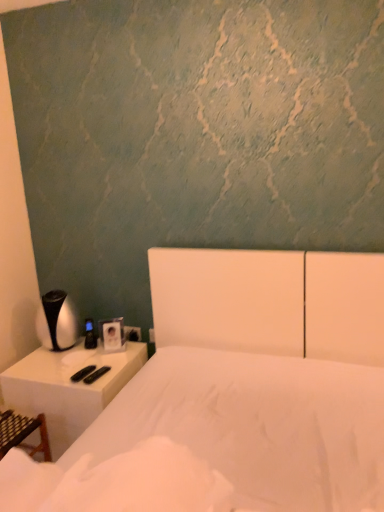
The height and width of the screenshot is (512, 384). Describe the element at coordinates (132, 333) in the screenshot. I see `white plastic electric outlet at lower center` at that location.

You are a GUI agent. You are given a task and a screenshot of the screen. Output one action in this format:
    pyautogui.click(x=<x>, y=<y>)
    Task: Click on the white matte bed at center
    
    Given the screenshot: What is the action you would take?
    [x=235, y=395]

This screenshot has width=384, height=512. Find the location of `white plastic nightstand at left`. white plastic nightstand at left is located at coordinates (68, 387).

Is white matte bed at center positioned with its back to white plastic electric outlet at lower center?

white matte bed at center is not turned away from white plastic electric outlet at lower center.

Is white matte bed at center not close to white plastic electric outlet at lower center?

No, white matte bed at center is in close proximity to white plastic electric outlet at lower center.

Who is bigger, white matte bed at center or white plastic electric outlet at lower center?

Bigger between the two is white matte bed at center.

From a real-world perspective, is white matte bed at center located beneath white plastic nightstand at left?

No, from a real-world perspective, white matte bed at center is not under white plastic nightstand at left.

Consider the image. From the image's perspective, which is below, white matte bed at center or white plastic nightstand at left?

white plastic nightstand at left is shown below in the image.

Is white matte bed at center in contact with white plastic nightstand at left?

No, white matte bed at center is not making contact with white plastic nightstand at left.

Does white matte bed at center have a lesser width compared to white plastic nightstand at left?

Incorrect, the width of white matte bed at center is not less than that of white plastic nightstand at left.

Does white plastic nightstand at left lie behind white matte bed at center?

A: Yes, white plastic nightstand at left is further from the viewer.

Considering the sizes of objects white plastic nightstand at left and white matte bed at center in the image provided, who is smaller, white plastic nightstand at left or white matte bed at center?

Smaller between the two is white plastic nightstand at left.

Can you tell me how much white plastic nightstand at left and white matte bed at center differ in facing direction?

The facing directions of white plastic nightstand at left and white matte bed at center are 0.59 degrees apart.

From the image's perspective, is white plastic nightstand at left above or below white plastic electric outlet at lower center?

Clearly, from the image's perspective, white plastic nightstand at left is below white plastic electric outlet at lower center.

What's the angular difference between white plastic nightstand at left and white plastic electric outlet at lower center's facing directions?

They differ by 0.99 degrees in their facing directions.

Does white plastic nightstand at left have a greater height compared to white plastic electric outlet at lower center?

Indeed, white plastic nightstand at left has a greater height compared to white plastic electric outlet at lower center.

Is white plastic nightstand at left wider or thinner than white plastic electric outlet at lower center?

Clearly, white plastic nightstand at left has more width compared to white plastic electric outlet at lower center.

Which is in front, white plastic electric outlet at lower center or white plastic nightstand at left?

white plastic nightstand at left.

Is white plastic electric outlet at lower center oriented away from white plastic nightstand at left?

No, white plastic electric outlet at lower center's orientation is not away from white plastic nightstand at left.

Could you measure the distance between white plastic electric outlet at lower center and white plastic nightstand at left?

white plastic electric outlet at lower center is 41.82 centimeters from white plastic nightstand at left.

Which is behind, point (135, 330) or point (64, 447)?

The point (135, 330) is farther.

Is white plastic electric outlet at lower center situated inside white matte bed at center or outside?

white plastic electric outlet at lower center lies outside white matte bed at center.

Can you tell me how much white plastic electric outlet at lower center and white matte bed at center differ in facing direction?

0.4 degrees.

From a real-world perspective, does white plastic electric outlet at lower center sit lower than white matte bed at center?

Indeed, from a real-world perspective, white plastic electric outlet at lower center is positioned beneath white matte bed at center.

Is white plastic electric outlet at lower center bigger or smaller than white matte bed at center?

Clearly, white plastic electric outlet at lower center is smaller in size than white matte bed at center.

Find the location of a particular element. electric outlet behind the white matte bed at center is located at coordinates (132, 333).

In order to click on nightstand below the white matte bed at center (from a real-world perspective) in this screenshot , I will do `click(68, 387)`.

From the picture: Based on their spatial positions, is white plastic nightstand at left or white plastic electric outlet at lower center closer to white matte bed at center?

Among the two, white plastic nightstand at left is located nearer to white matte bed at center.

Estimate the real-world distances between objects in this image. Which object is further from white plastic nightstand at left, white matte bed at center or white plastic electric outlet at lower center?

white matte bed at center.

Considering their positions, is white matte bed at center positioned further to white plastic electric outlet at lower center than white plastic nightstand at left?

white matte bed at center lies further to white plastic electric outlet at lower center than the other object.

Looking at the image, which one is located closer to white plastic electric outlet at lower center, white plastic nightstand at left or white matte bed at center?

white plastic nightstand at left is positioned closer to the anchor white plastic electric outlet at lower center.

Estimate the real-world distances between objects in this image. Which object is closer to white plastic nightstand at left, white plastic electric outlet at lower center or white matte bed at center?

white plastic electric outlet at lower center.

Estimate the real-world distances between objects in this image. Which object is closer to white matte bed at center, white plastic electric outlet at lower center or white plastic nightstand at left?

Among the two, white plastic nightstand at left is located nearer to white matte bed at center.

Find the location of `nightstand between white matte bed at center and white plastic electric outlet at lower center from front to back`. nightstand between white matte bed at center and white plastic electric outlet at lower center from front to back is located at coordinates (68, 387).